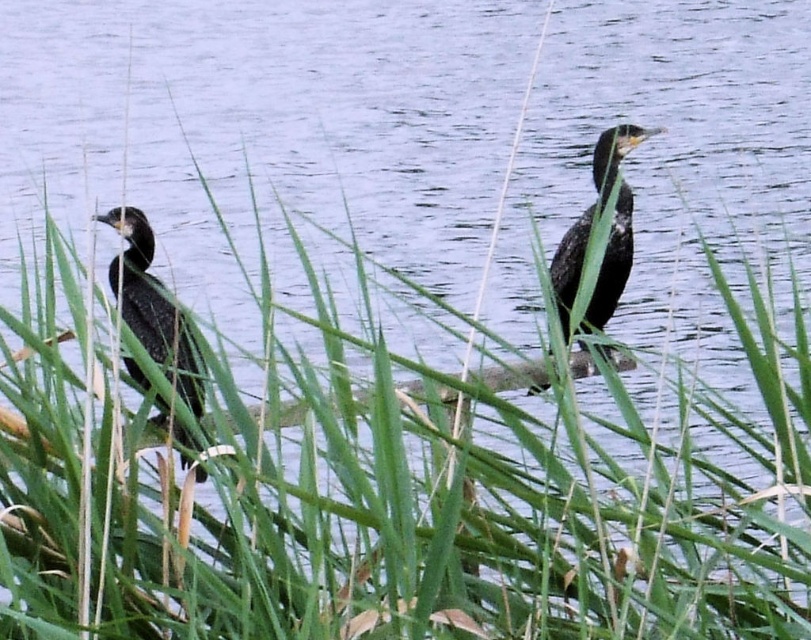
Question: Does shiny black bird at left appear on the right side of shiny black bird at center?

Choices:
 (A) yes
 (B) no

Answer: (B)

Question: Does shiny black bird at left appear on the right side of shiny black bird at center?

Choices:
 (A) yes
 (B) no

Answer: (B)

Question: Among these objects, which one is farthest from the camera?

Choices:
 (A) shiny black bird at left
 (B) shiny black bird at center

Answer: (B)

Question: Is shiny black bird at left positioned behind shiny black bird at center?

Choices:
 (A) no
 (B) yes

Answer: (A)